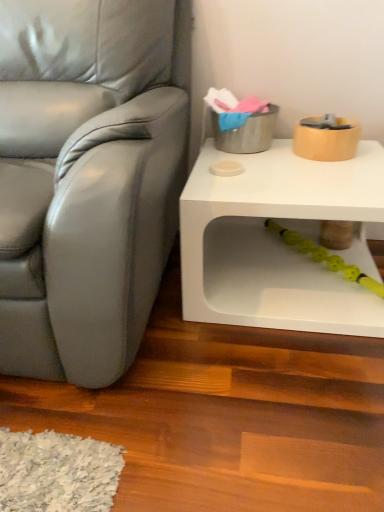
Question: Could you tell me if satin gray leather chair at left is turned towards white matte table at lower right?

Choices:
 (A) no
 (B) yes

Answer: (A)

Question: Can you confirm if satin gray leather chair at left is smaller than white matte table at lower right?

Choices:
 (A) yes
 (B) no

Answer: (B)

Question: Considering the relative sizes of satin gray leather chair at left and white matte table at lower right in the image provided, is satin gray leather chair at left shorter than white matte table at lower right?

Choices:
 (A) no
 (B) yes

Answer: (A)

Question: Considering the relative positions of satin gray leather chair at left and white matte table at lower right in the image provided, is satin gray leather chair at left to the left of white matte table at lower right from the viewer's perspective?

Choices:
 (A) yes
 (B) no

Answer: (A)

Question: Could white matte table at lower right be considered to be inside satin gray leather chair at left?

Choices:
 (A) yes
 (B) no

Answer: (B)

Question: Is satin gray leather chair at left not within white matte table at lower right?

Choices:
 (A) yes
 (B) no

Answer: (A)

Question: Is yellow rubber toy at lower center bigger than satin gray leather chair at left?

Choices:
 (A) yes
 (B) no

Answer: (B)

Question: Is yellow rubber toy at lower center aimed at satin gray leather chair at left?

Choices:
 (A) yes
 (B) no

Answer: (B)

Question: From a real-world perspective, is yellow rubber toy at lower center beneath satin gray leather chair at left?

Choices:
 (A) no
 (B) yes

Answer: (B)

Question: Is satin gray leather chair at left a part of yellow rubber toy at lower center?

Choices:
 (A) yes
 (B) no

Answer: (B)

Question: Is yellow rubber toy at lower center not close to satin gray leather chair at left?

Choices:
 (A) yes
 (B) no

Answer: (B)

Question: Is yellow rubber toy at lower center further to the viewer compared to satin gray leather chair at left?

Choices:
 (A) no
 (B) yes

Answer: (B)

Question: Is yellow rubber toy at lower center at the right side of white matte table at lower right?

Choices:
 (A) no
 (B) yes

Answer: (B)